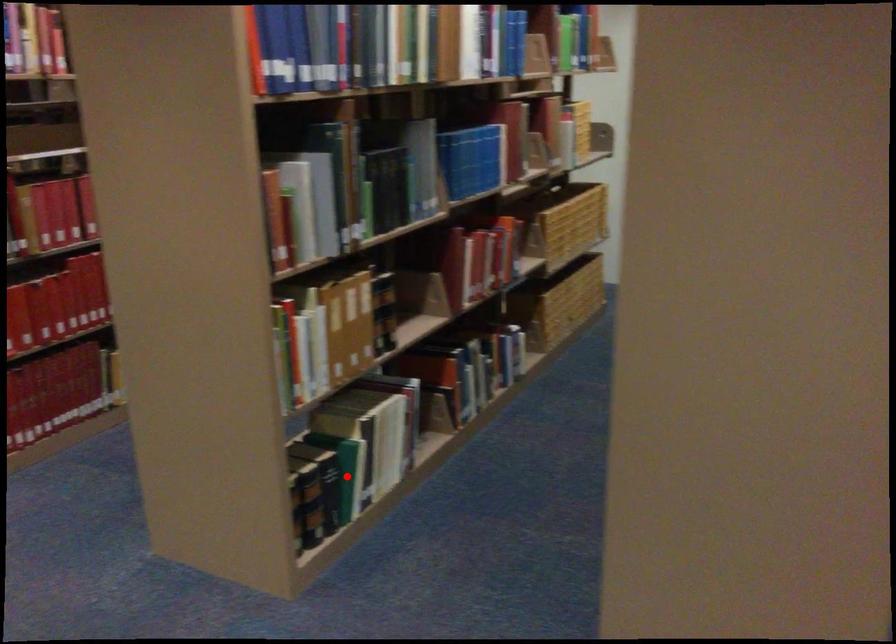
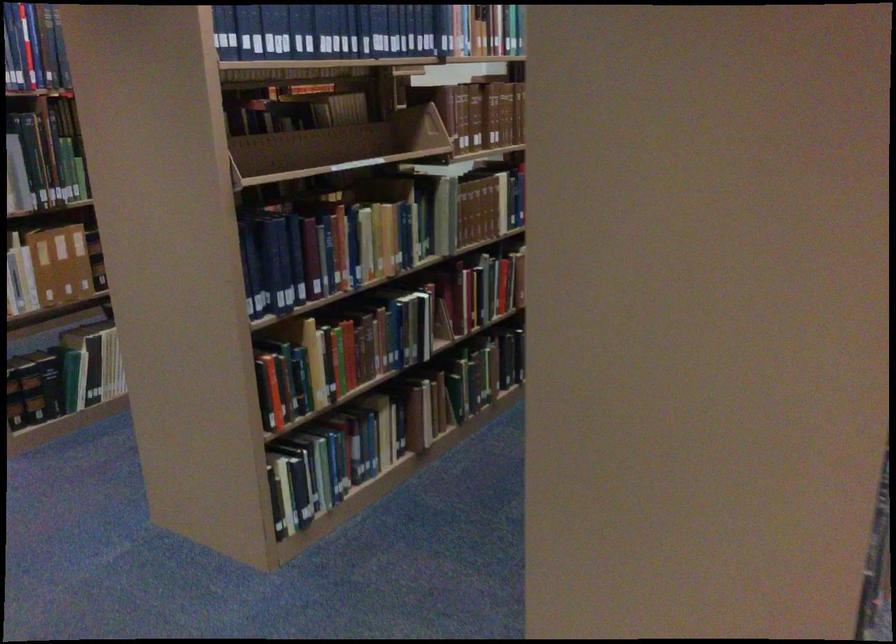
Find the pixel in the second image that matches the highlighted location in the first image.

(70, 379)